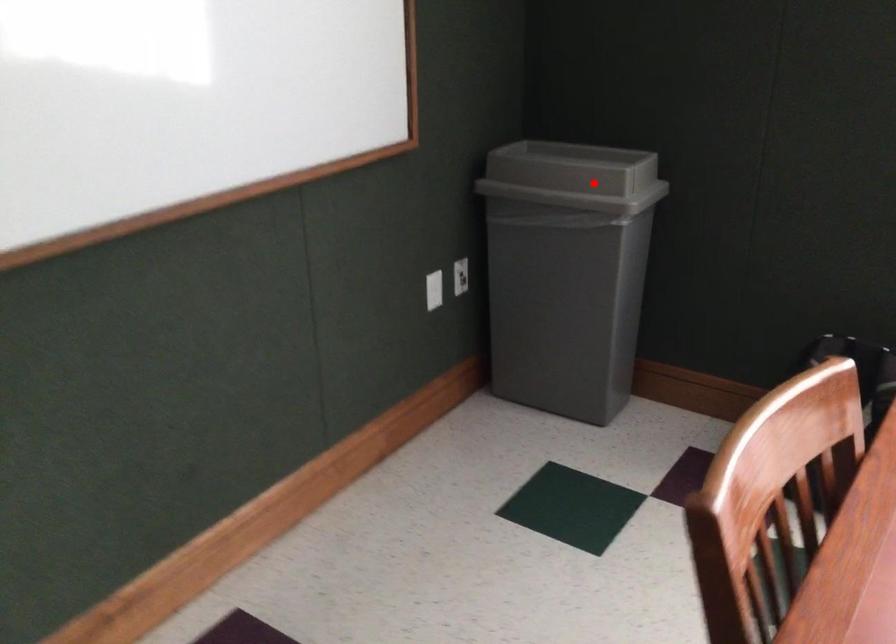
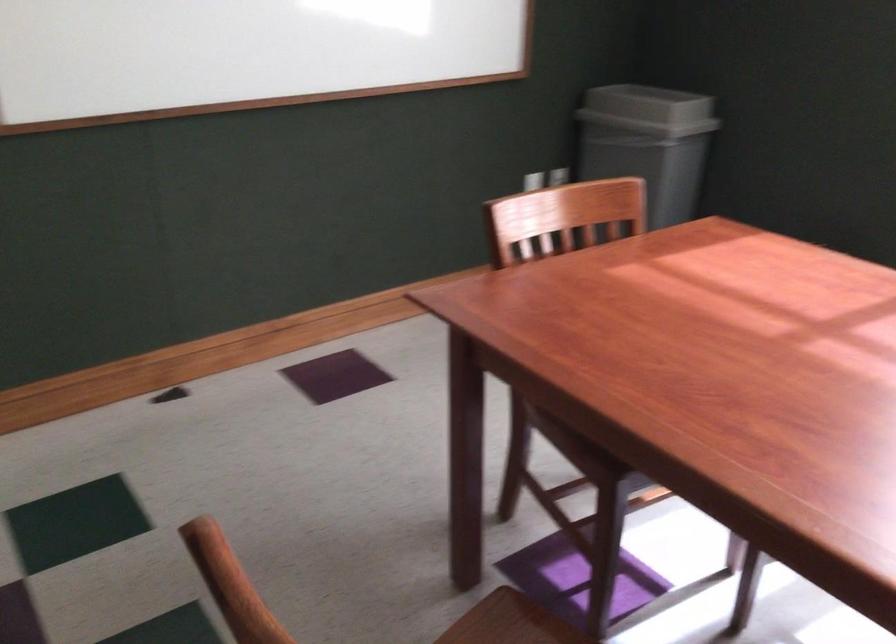
Find the pixel in the second image that matches the highlighted location in the first image.

(648, 109)